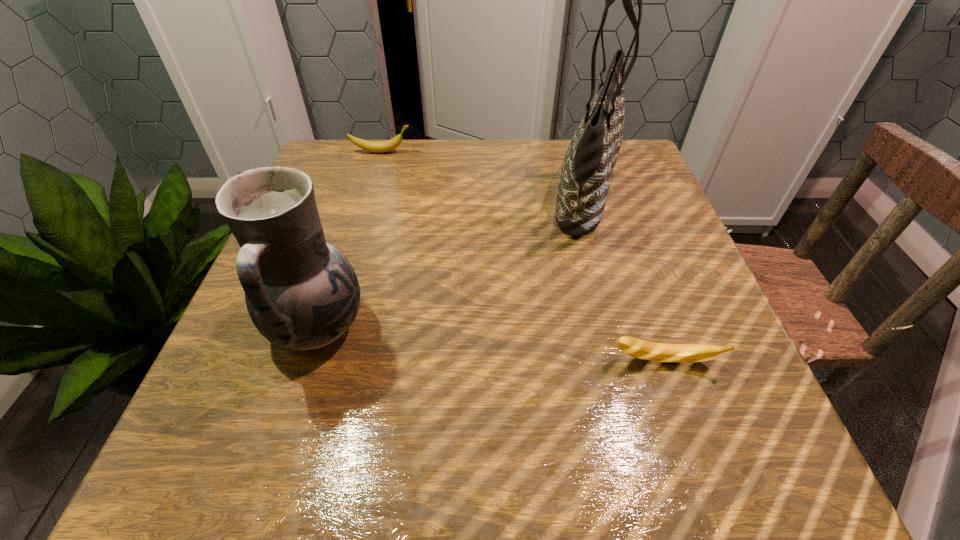
Locate an element on the screen. The width and height of the screenshot is (960, 540). tote bag is located at coordinates (583, 187).

Where is `the second tallest object`? This screenshot has height=540, width=960. the second tallest object is located at coordinates (301, 292).

At what (x,y) coordinates should I click in order to perform the action: click on the second shortest object. Please return your answer as a coordinate pair (x, y). This screenshot has width=960, height=540. Looking at the image, I should click on (372, 146).

I want to click on the taller banana, so click(372, 146).

Where is `the right banana`? the right banana is located at coordinates click(x=675, y=353).

The width and height of the screenshot is (960, 540). Identify the location of the shorter banana. (675, 353).

You are a GUI agent. You are given a task and a screenshot of the screen. Output one action in this format:
    pyautogui.click(x=<x>, y=<y>)
    Task: Click on the vacant space located 0.320m on the left of the tallest object
    
    Given the screenshot: What is the action you would take?
    pyautogui.click(x=410, y=191)

I want to click on vacant region located 0.070m on the front-facing side of the pitcher, so click(408, 327).

At what (x,y) coordinates should I click in order to perform the action: click on free region located 0.080m at the stem of the farther banana. Please return your answer as a coordinate pair (x, y). The image size is (960, 540). Looking at the image, I should click on (443, 152).

Where is `blank area located at the stem of the shortest object`? This screenshot has height=540, width=960. blank area located at the stem of the shortest object is located at coordinates (685, 427).